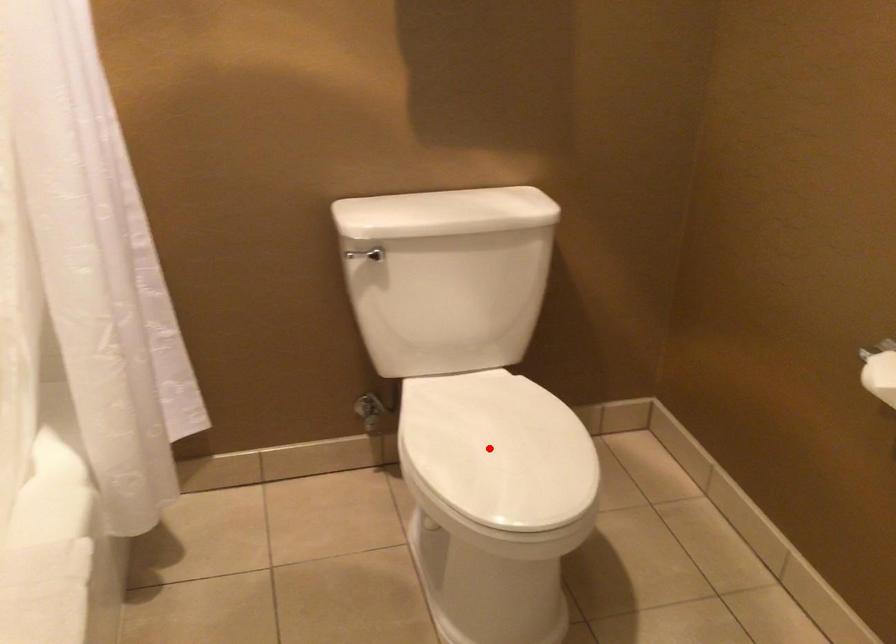
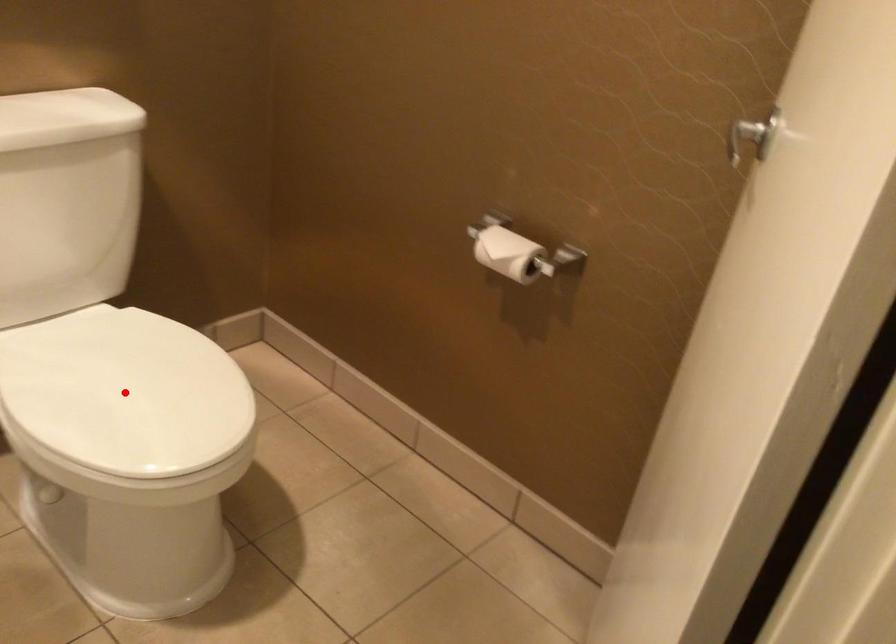
Looking at this image, I am providing you with two images of the same scene from different viewpoints. A red point is marked on the first image and another point is marked on the second image. Is the red point in image1 aligned with the point shown in image2?

Yes